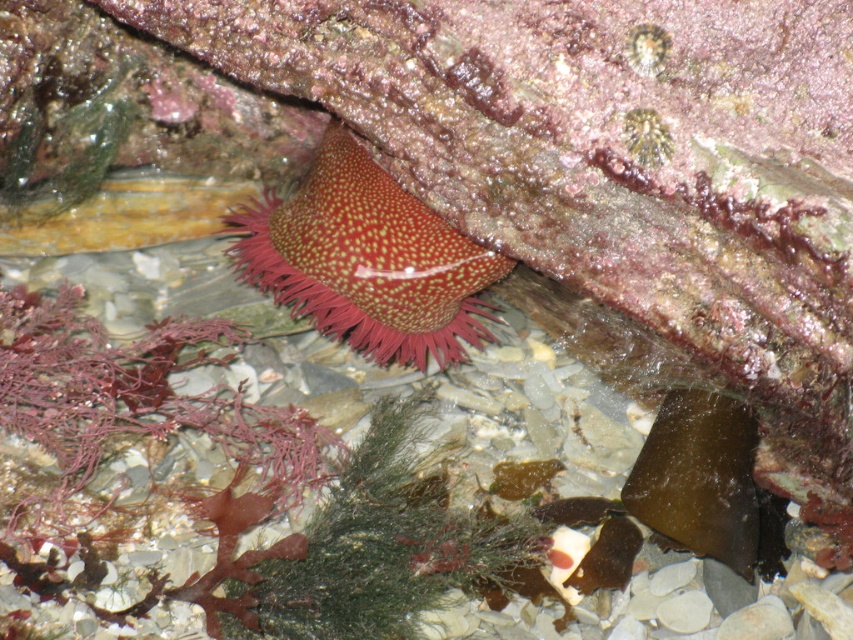
You are a marine biologist with a camera. You are observing the underwater scene and want to take a closeup photo of the shiny red anemone at center. Your camera has a maximum focus range of 1 meter. Can you take the photo from your current position without moving closer?

The shiny red anemone at center and camera are 1.27 meters apart. Since the camera can only focus up to 1 meter, you need to move closer to within 1 meter to take the closeup photo.

You are a marine biologist studying underwater life. You observe the shiny red anemone at center in the image. What are the coordinates of its position?

The coordinates of the shiny red anemone at center are at point (x=366, y=259).

You are a marine biologist observing the underwater scene. You notice the shiny red anemone at center and the green matte algae at center. Which object is closer to you, the observer?

The shiny red anemone at center is closer to you because the green matte algae at center is behind it.